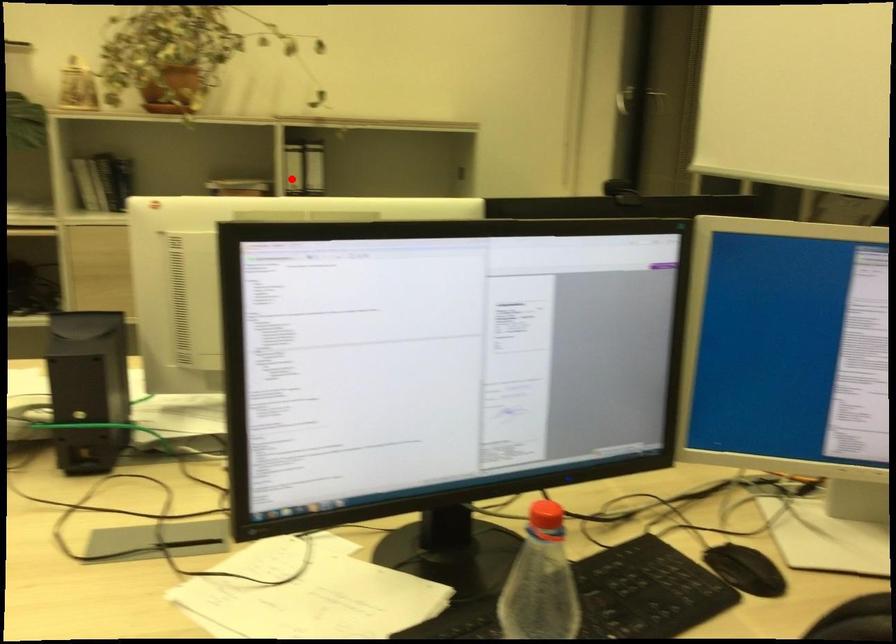
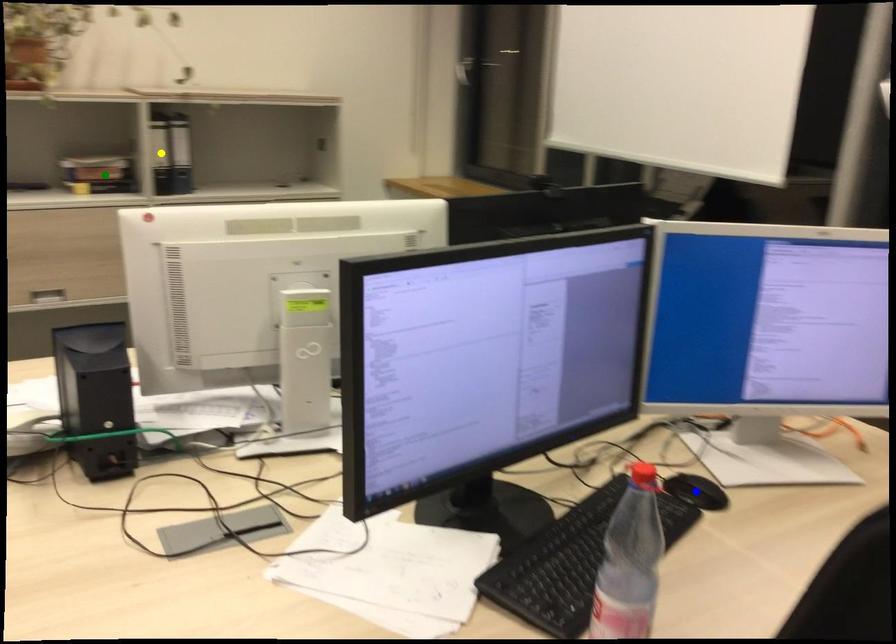
Question: I am providing you with two images of the same scene from different viewpoints. A red point is marked on the first image. You are given multiple points on the second image. In image 2, which mark is for the same physical point as the one in image 1?

Choices:
 (A) blue point
 (B) yellow point
 (C) green point

Answer: (B)